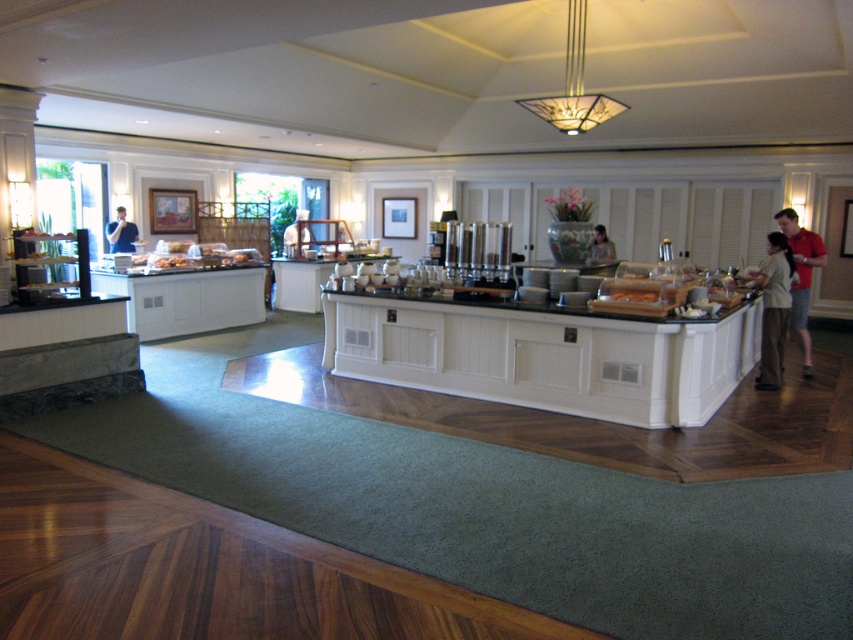
Between red cotton shirt at right and matte black shirt at center, which one appears on the left side from the viewer's perspective?

From the viewer's perspective, matte black shirt at center appears more on the left side.

In the scene shown: Is red cotton shirt at right wider than matte black shirt at center?

Incorrect, red cotton shirt at right's width does not surpass matte black shirt at center's.

Is point (821, 257) more distant than point (606, 248)?

No.

Identify the location of red cotton shirt at right. Image resolution: width=853 pixels, height=640 pixels. (801, 276).

Can you confirm if smooth white shirt at center is thinner than matte black shirt at center?

Indeed, smooth white shirt at center has a lesser width compared to matte black shirt at center.

Looking at this image, who is more distant from viewer, (288, 253) or (601, 240)?

The point (288, 253) is more distant.

Find the location of a particular element. smooth white shirt at center is located at coordinates (296, 234).

Who is taller, light beige pants at right or matte black shirt at center?

light beige pants at right

Is light beige pants at right above matte black shirt at center?

Actually, light beige pants at right is below matte black shirt at center.

Where is `light beige pants at right`? light beige pants at right is located at coordinates (773, 308).

Locate an element on the screen. light beige pants at right is located at coordinates (773, 308).